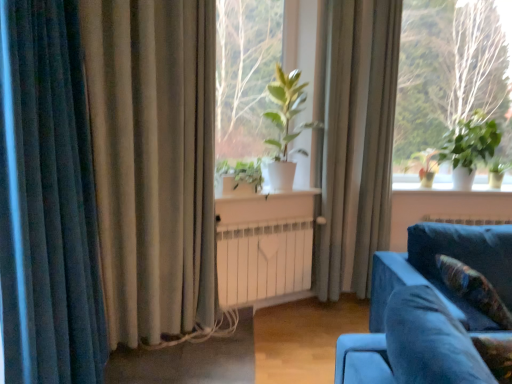
Question: Based on their positions, is velvet floral pillow at lower right located to the left or right of green leafy plant at center?

Choices:
 (A) right
 (B) left

Answer: (A)

Question: Looking at their shapes, would you say velvet floral pillow at lower right is wider or thinner than green leafy plant at center?

Choices:
 (A) wide
 (B) thin

Answer: (A)

Question: Which object is positioned closest to the green matte plant at center?

Choices:
 (A) green matte plant at center, which ranks as the 1th plant in left-to-right order
 (B) white matte radiator at center
 (C) green matte plant at right, marked as the 1th plant in a right-to-left arrangement
 (D) beige fabric curtain at left, acting as the 2th curtain starting from the right
 (E) velvet blue couch at lower right

Answer: (A)

Question: Estimate the real-world distances between objects in this image. Which object is farther from the green leafy plant at upper right?

Choices:
 (A) white matte radiator at center
 (B) green matte plant at right, marked as the 1th plant in a right-to-left arrangement
 (C) silky beige curtain at center, the 3th curtain when ordered from front to back
 (D) white plastic window sill at right
 (E) beige fabric curtain at left, acting as the 2th curtain starting from the right

Answer: (E)